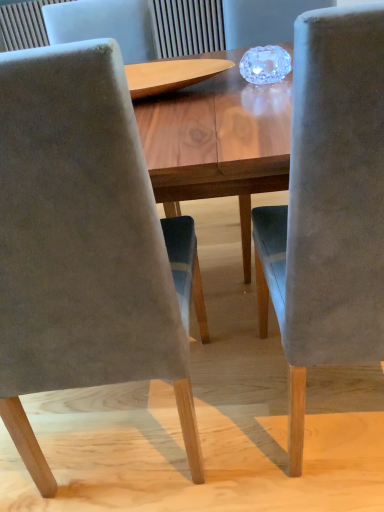
I want to click on empty space that is in between velvet gray chair at right, which ranks as the first chair in right-to-left order, and velvet gray chair at center, the 1th chair positioned from the left, so click(x=239, y=410).